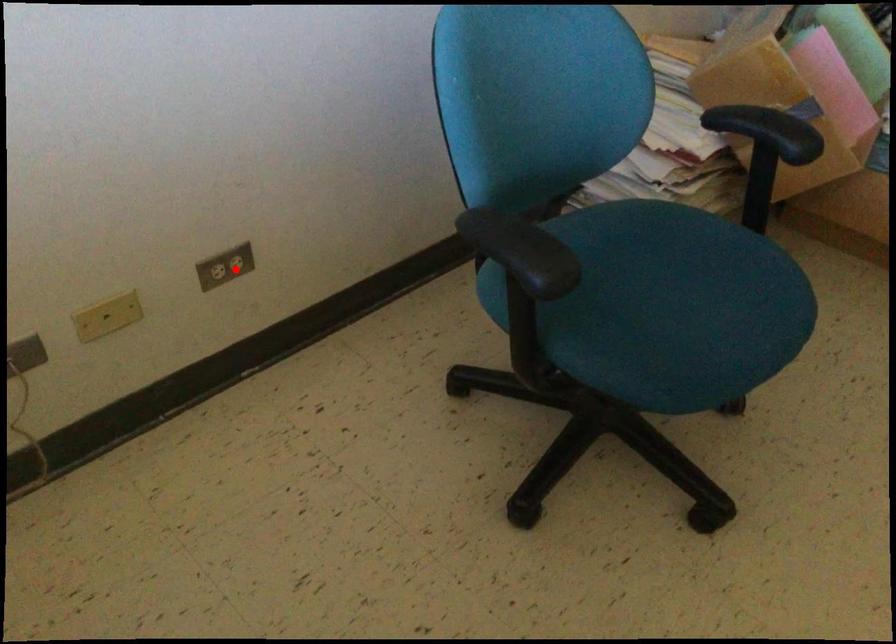
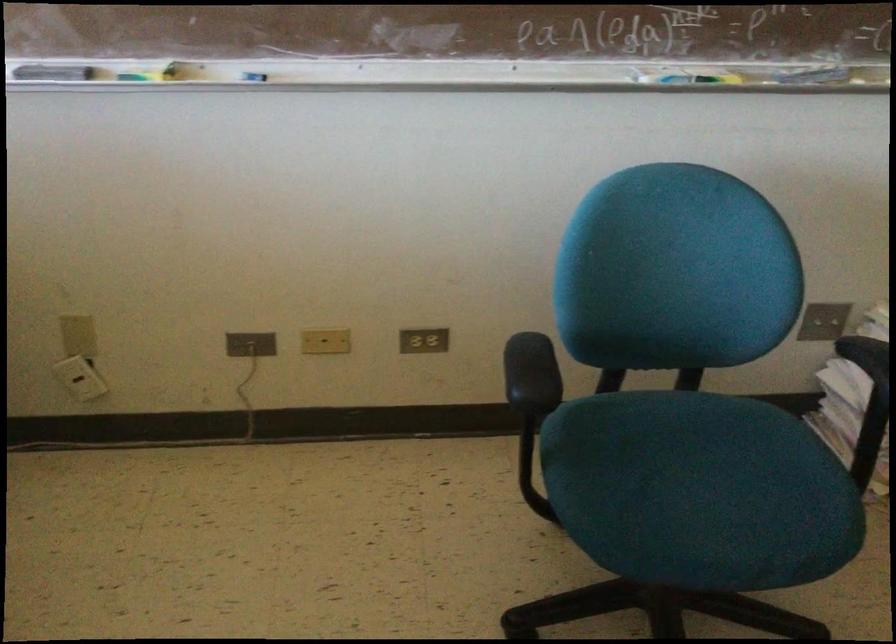
Question: I am providing you with two images of the same scene from different viewpoints. In image1, a red point is highlighted. Considering the same 3D point in image2, which of the following is correct?

Choices:
 (A) It is closer
 (B) It is farther

Answer: (B)